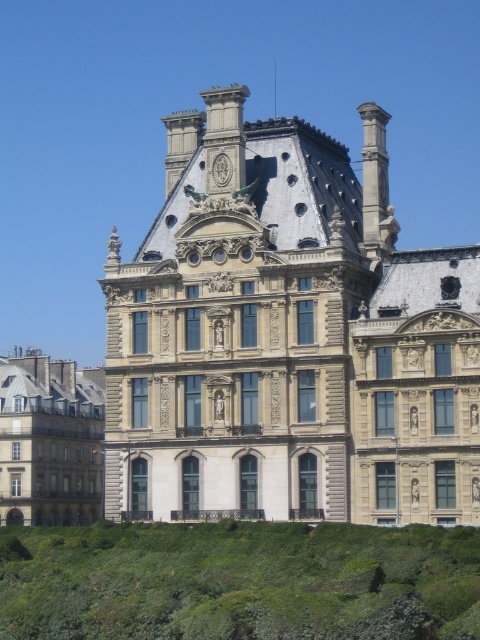
Looking at this image, you are standing at the center of the image looking at the grand building. Where is the green grass at lower left located in relation to your position?

The green grass at lower left is located at point [239,580] in the image coordinate system, which is to the lower left of your current position.

You are a delivery person with a cart that is 2 meters wide. You need to move from the green grass at lower left to the beige stone building at center. Is there enough space between them for your cart to pass through?

The distance between the beige stone building at center and green grass at lower left is 10.71 meters, so yes, the cart can pass through since the distance is greater than the cart width of 2 meters.

You are an architect analyzing the symmetry of the buildings in the scene. Which building, the beige stone building at center or the matte stone building at left, would you say is the larger one in terms of size?

The beige stone building at center is larger in size than the matte stone building at left.